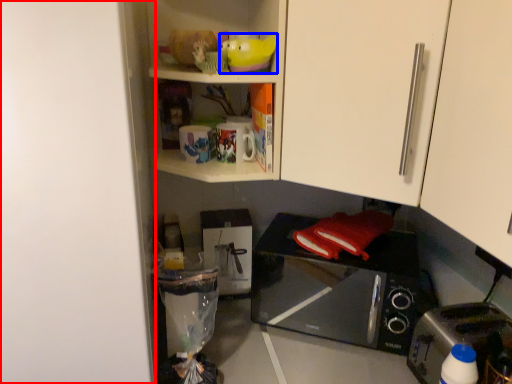
Question: Which point is closer to the camera, door (highlighted by a red box) or toy (highlighted by a blue box)?

Choices:
 (A) door
 (B) toy

Answer: (A)